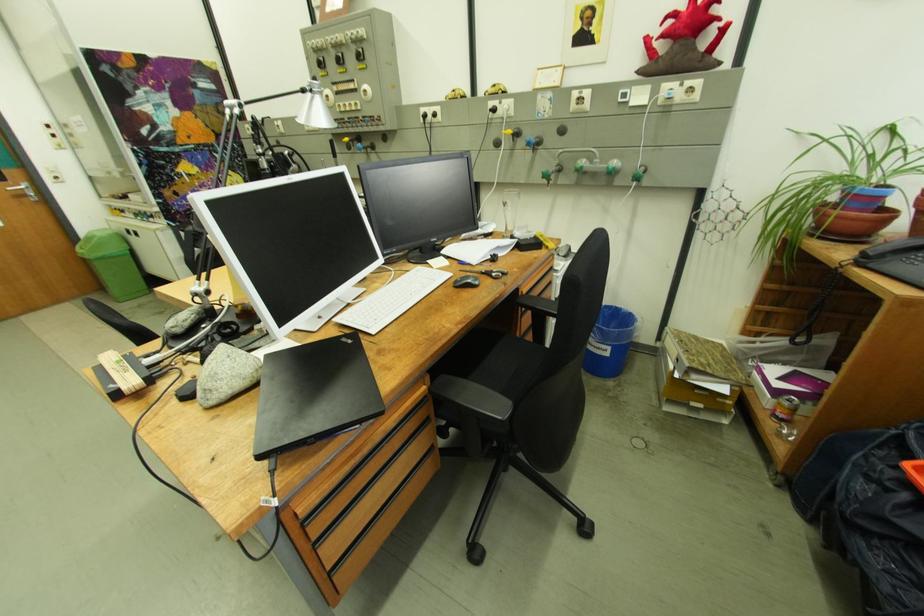
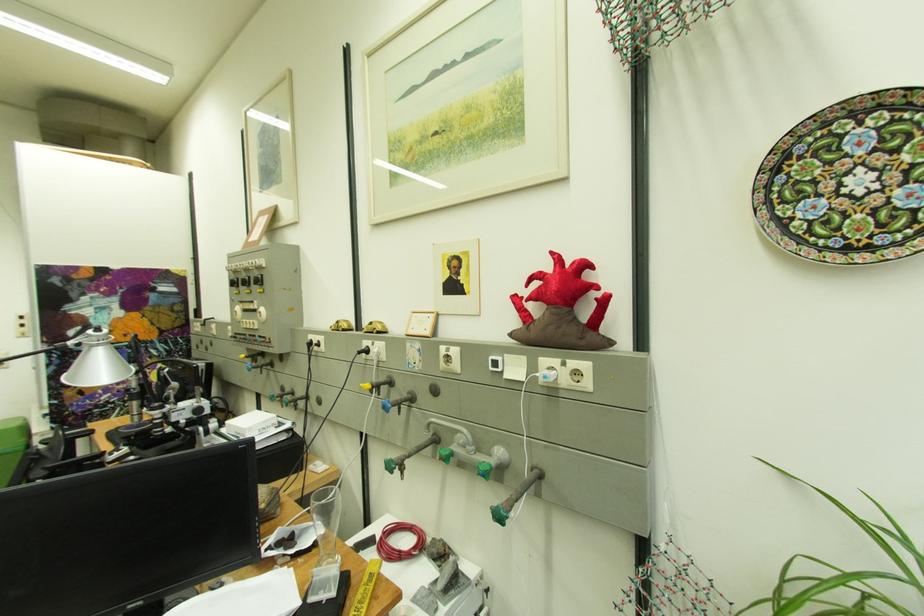
Locate, in the second image, the point that corresponds to point (585, 94) in the first image.

(454, 351)